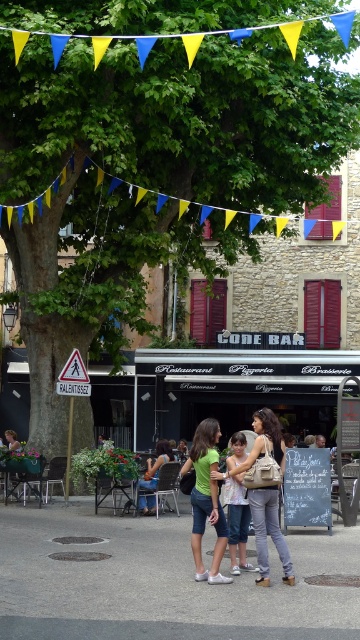
Is green cotton shirt at center to the left of denim shorts at center from the viewer's perspective?

In fact, green cotton shirt at center is to the right of denim shorts at center.

Is green cotton shirt at center positioned in front of denim shorts at center?

Yes, it is.

Which is in front, point (206, 509) or point (146, 480)?

Positioned in front is point (206, 509).

Identify the location of green cotton shirt at center. (205, 499).

Based on the photo, how much distance is there between black canvas food truck at center and white cotton shirt at center?

A distance of 65.89 feet exists between black canvas food truck at center and white cotton shirt at center.

Is black canvas food truck at center positioned before white cotton shirt at center?

No, it is not.

Identify the location of black canvas food truck at center. (236, 388).

From the picture: Who is more forward, (178, 403) or (150, 483)?

Point (150, 483) is in front.

In the scene shown: Does black canvas food truck at center lie in front of denim shorts at center?

No, black canvas food truck at center is further to the viewer.

Is point (303, 420) positioned behind point (150, 460)?

That is True.

The width and height of the screenshot is (360, 640). Identify the location of black canvas food truck at center. (236, 388).